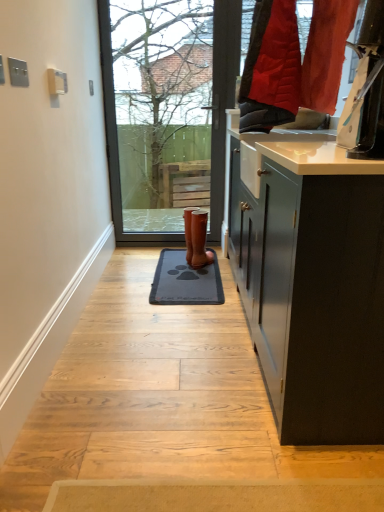
This screenshot has height=512, width=384. In order to click on free space in front of brown leather boot at center in this screenshot , I will do `click(208, 269)`.